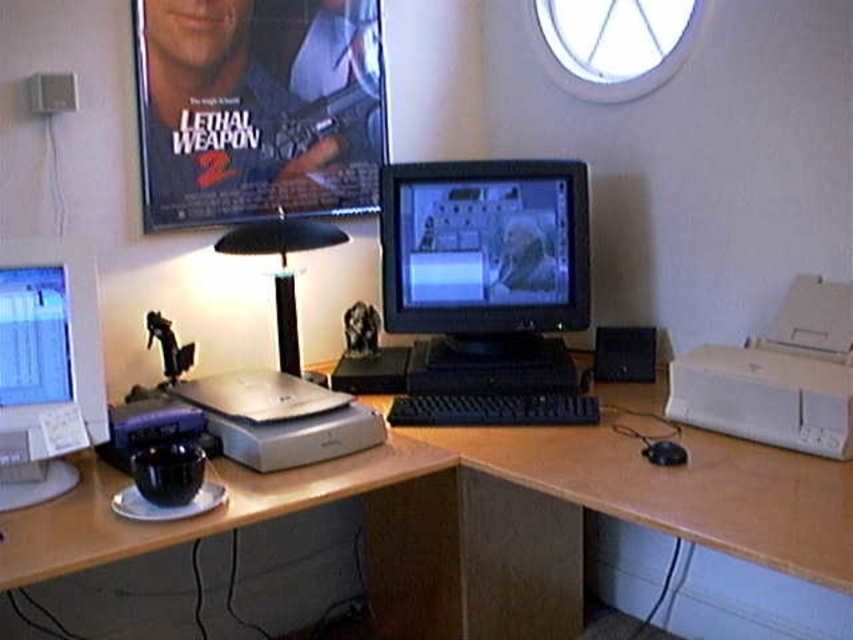
Question: Can you confirm if wooden at center is wider than sleek silver laptop at center?

Choices:
 (A) yes
 (B) no

Answer: (A)

Question: Estimate the real-world distances between objects in this image. Which object is closer to the black plastic mouse at lower right?

Choices:
 (A) wooden at center
 (B) sleek silver laptop at center

Answer: (A)

Question: Among these objects, which one is farthest from the camera?

Choices:
 (A) matte plastic poster at upper left
 (B) wooden at center
 (C) black plastic keyboard at center
 (D) white matte printer at right

Answer: (A)

Question: Observing the image, what is the correct spatial positioning of wooden at center in reference to black plastic lamp at center?

Choices:
 (A) above
 (B) below

Answer: (B)

Question: Which of the following is the farthest from the observer?

Choices:
 (A) matte black monitor at center
 (B) white matte printer at right

Answer: (A)

Question: Does black plastic keyboard at center come in front of black plastic mouse at lower right?

Choices:
 (A) yes
 (B) no

Answer: (B)